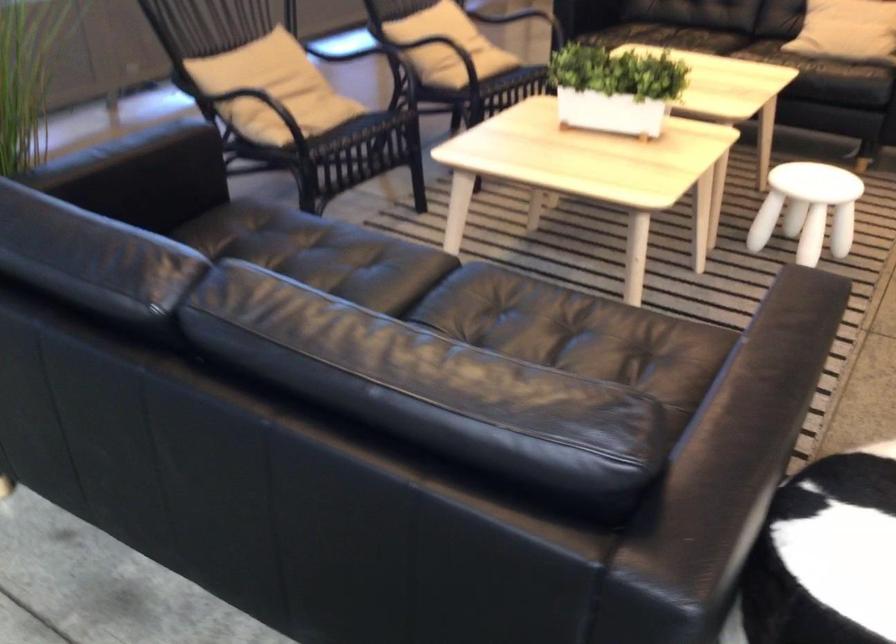
The image size is (896, 644). What are the coordinates of `black sofa sitting surface` in the screenshot? It's located at (333, 256).